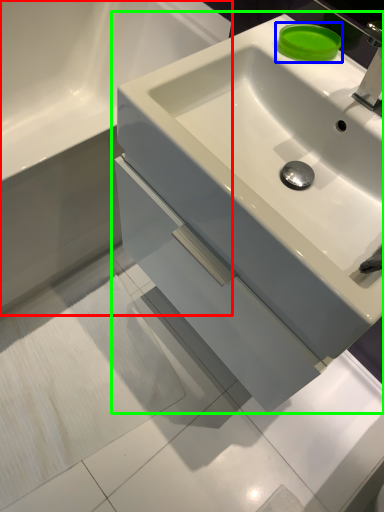
Question: Which object is the closest to the bathroom cabinet (highlighted by a red box)? Choose among these: soap (highlighted by a blue box) or sink (highlighted by a green box).

Choices:
 (A) soap
 (B) sink

Answer: (B)